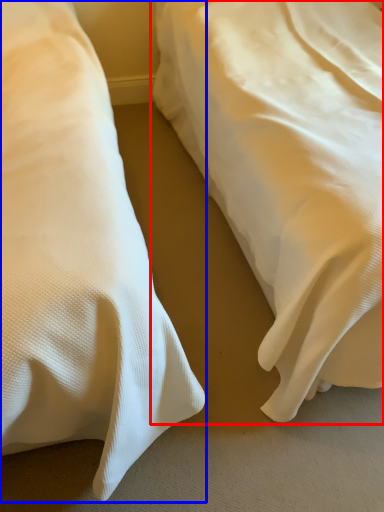
Question: Which point is further to the camera, bed (highlighted by a red box) or bed (highlighted by a blue box)?

Choices:
 (A) bed
 (B) bed

Answer: (A)